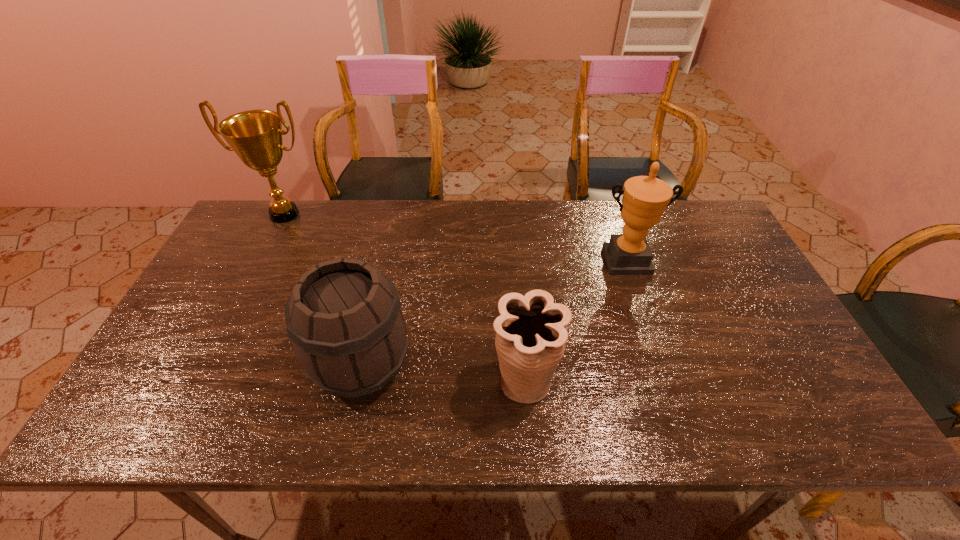
This screenshot has height=540, width=960. I want to click on vacant space located on the back of the wine bucket, so click(x=386, y=256).

Locate an element on the screen. This screenshot has height=540, width=960. vacant space located on the back of the third object from left to right is located at coordinates (520, 326).

In order to click on object at the far edge in this screenshot , I will do `click(255, 136)`.

Where is `wine bucket present at the near edge`? wine bucket present at the near edge is located at coordinates pyautogui.click(x=344, y=318).

Where is `urn that is at the near edge`? This screenshot has height=540, width=960. urn that is at the near edge is located at coordinates (531, 333).

You are a GUI agent. You are given a task and a screenshot of the screen. Output one action in this format:
    pyautogui.click(x=<x>, y=<y>)
    Task: Click on the object that is at the left edge
    The width and height of the screenshot is (960, 540).
    Given the screenshot: What is the action you would take?
    pyautogui.click(x=255, y=136)

Locate an element on the screen. This screenshot has height=540, width=960. object located at the far left corner is located at coordinates (255, 136).

In the image, there is a desktop. Identify the location of vacant space at the far edge. (588, 208).

Locate an element on the screen. The image size is (960, 540). vacant area at the near edge is located at coordinates (444, 412).

In the image, there is a desktop. Where is `vacant space at the left edge`? This screenshot has height=540, width=960. vacant space at the left edge is located at coordinates (164, 346).